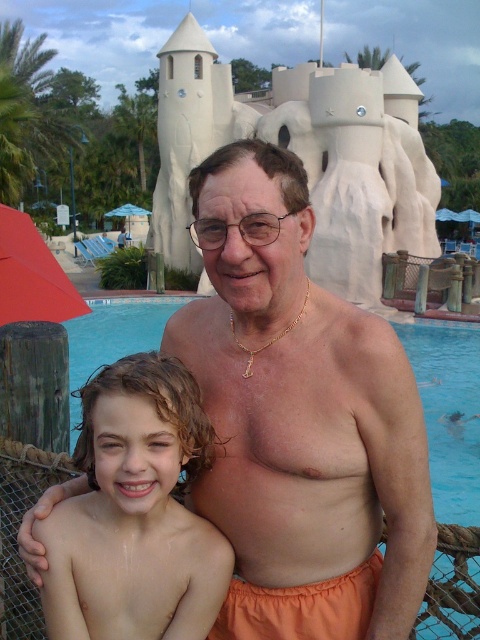
Measure the distance between point (24, 317) and camera.

They are 26.26 meters apart.

Which is more to the left, red fabric umbrella at left or transparent plastic umbrella at upper left?

transparent plastic umbrella at upper left is more to the left.

Between point (35, 307) and point (126, 211), which one is positioned behind?

Point (126, 211)

Locate an element on the screen. red fabric umbrella at left is located at coordinates (32, 275).

Does point (314, 616) come farther from viewer compared to point (176, 460)?

Yes.

Can you confirm if orange fabric shorts at center is smaller than light brown curly hair at center?

Incorrect, orange fabric shorts at center is not smaller in size than light brown curly hair at center.

What do you see at coordinates (300, 419) in the screenshot? I see `orange fabric shorts at center` at bounding box center [300, 419].

Where is `orange fabric shorts at center`? orange fabric shorts at center is located at coordinates (300, 419).

Does orange fabric shorts at center have a smaller size compared to transparent plastic umbrella at upper left?

Yes.

This screenshot has height=640, width=480. What do you see at coordinates (300, 419) in the screenshot?
I see `orange fabric shorts at center` at bounding box center [300, 419].

Identify the location of orange fabric shorts at center. (300, 419).